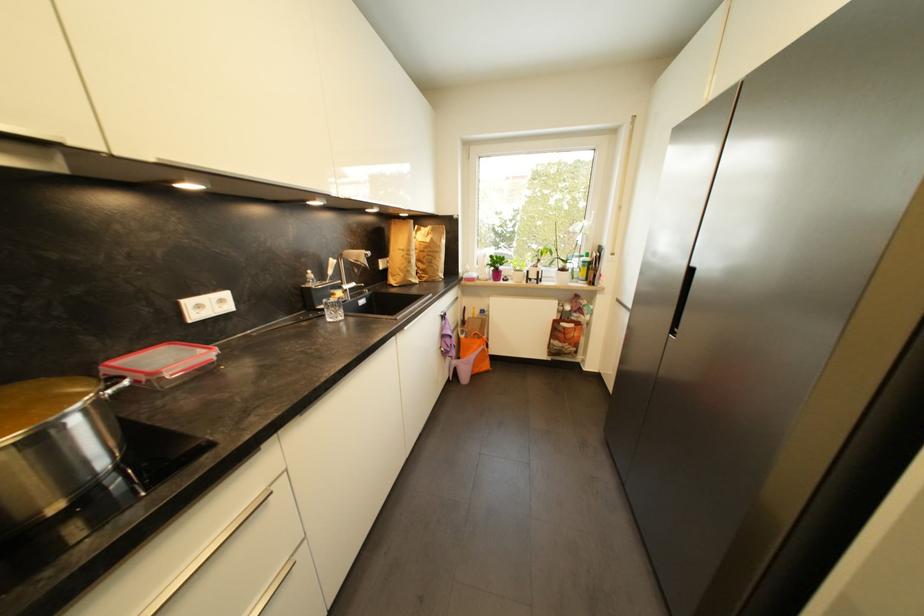
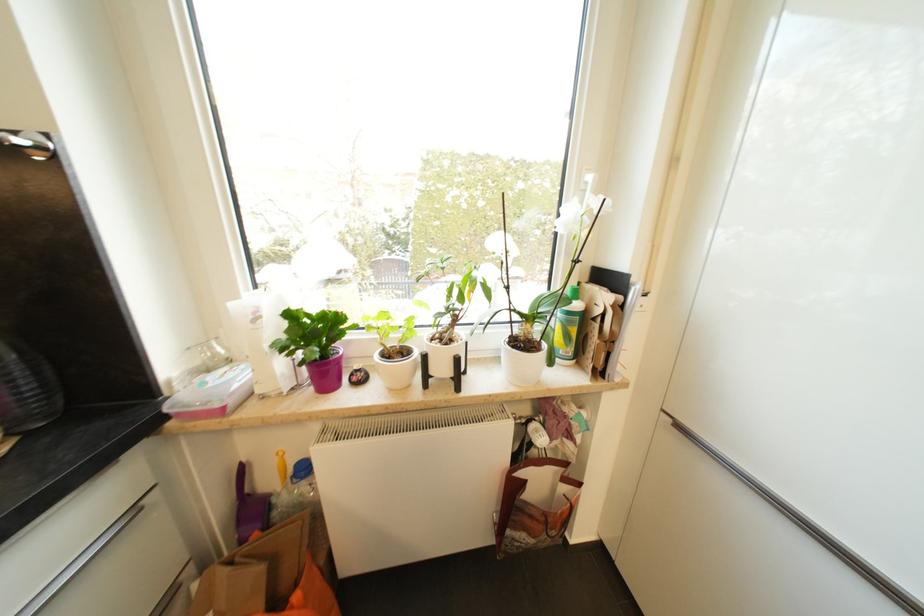
Find the pixel in the second image that matches the point at 538,278 in the first image.

(446, 371)